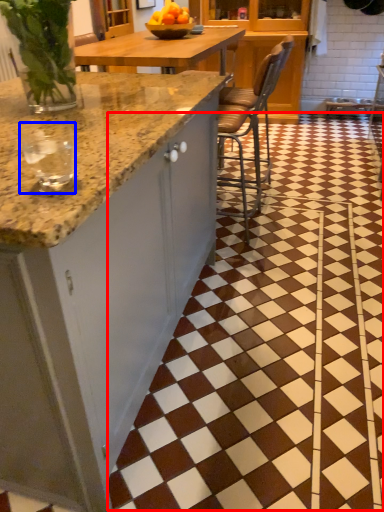
Question: Which point is further to the camera, tile (highlighted by a red box) or wine glass (highlighted by a blue box)?

Choices:
 (A) tile
 (B) wine glass

Answer: (A)